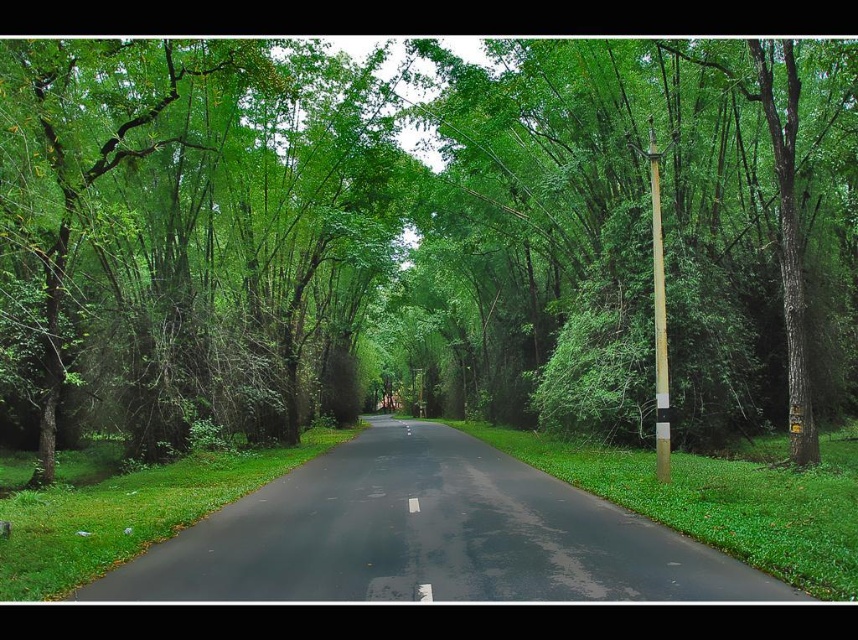
You are driving a car and see the black asphalt road at center and the brown wooden pole at right. Which object is closer to the ground?

The black asphalt road at center is positioned under the brown wooden pole at right, so the road is closer to the ground.

You are standing at the starting point of the road and want to locate the green leafy tree at center. What are the coordinates of the tree relative to your position?

The coordinates of the green leafy tree at center relative to your position are at point 0.328 on the x axis and 0.469 on the y axis.